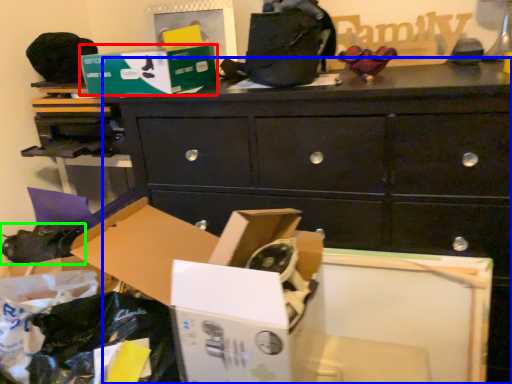
Question: Which is farther away from storage box (highlighted by a red box)? chest of drawers (highlighted by a blue box) or shoe (highlighted by a green box)?

Choices:
 (A) chest of drawers
 (B) shoe

Answer: (B)